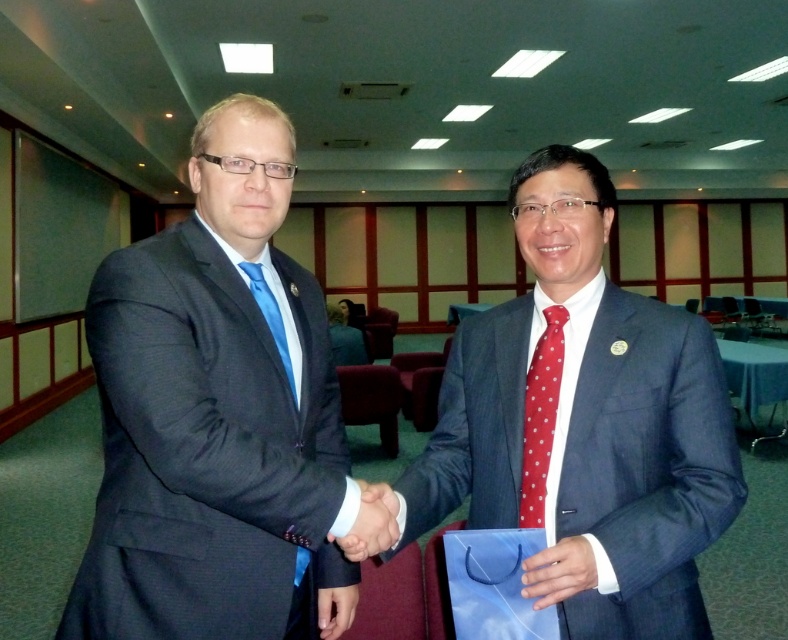
Question: Among these points, which one is nearest to the camera?

Choices:
 (A) (537, 426)
 (B) (374, 492)
 (C) (264, 284)

Answer: (B)

Question: Is matte black suit at left bigger than red dotted tie at center?

Choices:
 (A) no
 (B) yes

Answer: (B)

Question: Where is blue textured suit at center located in relation to red dotted tie at center in the image?

Choices:
 (A) right
 (B) left

Answer: (A)

Question: Considering the real-world distances, which object is closest to the matte black suit at left?

Choices:
 (A) red dotted tie at center
 (B) matte black hand at center
 (C) blue textured suit at center

Answer: (B)

Question: Which object is positioned closest to the matte black hand at center?

Choices:
 (A) matte black suit at left
 (B) matte blue suit at center

Answer: (B)

Question: Can you confirm if matte black suit at left is positioned to the left of blue textured suit at center?

Choices:
 (A) no
 (B) yes

Answer: (B)